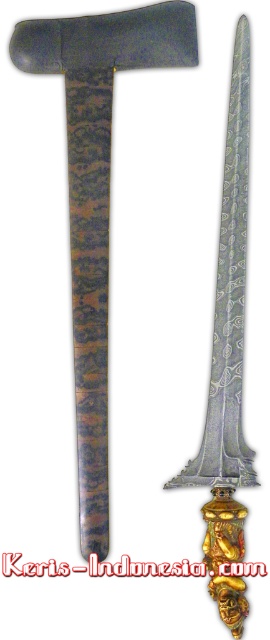
Where is the polished silver sword at center located in the image?

The polished silver sword at center is located at point coordinates of 0.308 on the x axis and 0.359 on the y axis.

You are an art conservator examining two swords displayed in a museum case. You notice the polished silver sword at center and the silver polished metal sword at center. Which one is positioned further away from you?

The silver polished metal sword at center is positioned further away from you because it is behind the polished silver sword at center.

You are an art conservator examining a traditional Indonesian keris displayed against a white background. The keris has a blade with intricate patterns and a wooden handle. You notice a point marked at coordinates [96,196]. Can you identify what this point corresponds to on the keris?

The point at coordinates [96,196] corresponds to the polished silver sword at the center of the keris.